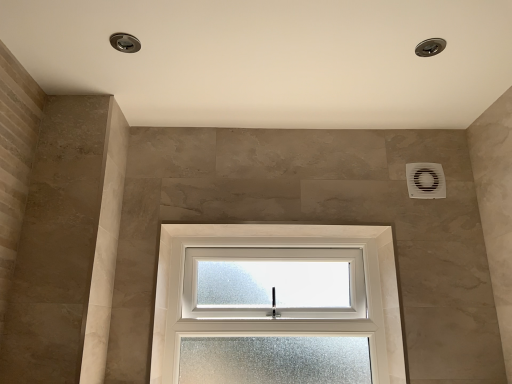
Describe the element at coordinates (282, 312) in the screenshot. The width and height of the screenshot is (512, 384). I see `white frosted glass window at center` at that location.

Where is `white frosted glass window at center`? This screenshot has height=384, width=512. white frosted glass window at center is located at coordinates (282, 312).

The width and height of the screenshot is (512, 384). Describe the element at coordinates (425, 180) in the screenshot. I see `white plastic air conditioning unit at upper right` at that location.

Identify the location of white plastic air conditioning unit at upper right. (425, 180).

Where is `white frosted glass window at center`? Image resolution: width=512 pixels, height=384 pixels. white frosted glass window at center is located at coordinates (282, 312).

Considering the positions of objects white frosted glass window at center and white plastic air conditioning unit at upper right in the image provided, who is more to the left, white frosted glass window at center or white plastic air conditioning unit at upper right?

white frosted glass window at center is more to the left.

Is the position of white frosted glass window at center less distant than that of white plastic air conditioning unit at upper right?

Yes, white frosted glass window at center is closer to the viewer.

Considering the positions of point (156, 370) and point (433, 165), is point (156, 370) closer or farther from the camera than point (433, 165)?

Point (156, 370) appears to be closer to the viewer than point (433, 165).

From the image's perspective, between white frosted glass window at center and white plastic air conditioning unit at upper right, who is located below?

white frosted glass window at center.

From a real-world perspective, who is located lower, white frosted glass window at center or white plastic air conditioning unit at upper right?

From a 3D spatial view, white frosted glass window at center is below.

Can you confirm if white frosted glass window at center is thinner than white plastic air conditioning unit at upper right?

Incorrect, the width of white frosted glass window at center is not less than that of white plastic air conditioning unit at upper right.

Considering the sizes of objects white frosted glass window at center and white plastic air conditioning unit at upper right in the image provided, who is shorter, white frosted glass window at center or white plastic air conditioning unit at upper right?

Standing shorter between the two is white plastic air conditioning unit at upper right.

Considering the relative sizes of white frosted glass window at center and white plastic air conditioning unit at upper right in the image provided, is white frosted glass window at center smaller than white plastic air conditioning unit at upper right?

Actually, white frosted glass window at center might be larger than white plastic air conditioning unit at upper right.

Is white frosted glass window at center positioned beyond the bounds of white plastic air conditioning unit at upper right?

Yes, white frosted glass window at center is outside of white plastic air conditioning unit at upper right.

Is white frosted glass window at center with white plastic air conditioning unit at upper right?

No, white frosted glass window at center is not making contact with white plastic air conditioning unit at upper right.

Does white frosted glass window at center turn towards white plastic air conditioning unit at upper right?

No, white frosted glass window at center is not oriented towards white plastic air conditioning unit at upper right.

Find the location of a particular element. The image size is (512, 384). window below the white plastic air conditioning unit at upper right (from the image's perspective) is located at coordinates (282, 312).

Which is more to the left, white plastic air conditioning unit at upper right or white frosted glass window at center?

From the viewer's perspective, white frosted glass window at center appears more on the left side.

Considering their positions, is white plastic air conditioning unit at upper right located in front of or behind white frosted glass window at center?

white plastic air conditioning unit at upper right is behind white frosted glass window at center.

Which is closer to the camera, (407,182) or (165,306)?

Clearly, point (407,182) is closer to the camera than point (165,306).

From the image's perspective, is white plastic air conditioning unit at upper right above or below white frosted glass window at center?

From the image's perspective, white plastic air conditioning unit at upper right appears above white frosted glass window at center.

From a real-world perspective, which object rests below the other?

From a 3D spatial view, white frosted glass window at center is below.

In terms of width, does white plastic air conditioning unit at upper right look wider or thinner when compared to white frosted glass window at center?

Considering their sizes, white plastic air conditioning unit at upper right looks slimmer than white frosted glass window at center.

Is white plastic air conditioning unit at upper right shorter than white frosted glass window at center?

Correct, white plastic air conditioning unit at upper right is not as tall as white frosted glass window at center.

Considering the sizes of objects white plastic air conditioning unit at upper right and white frosted glass window at center in the image provided, who is smaller, white plastic air conditioning unit at upper right or white frosted glass window at center?

white plastic air conditioning unit at upper right is smaller.

Based on the photo, is white plastic air conditioning unit at upper right surrounding white frosted glass window at center?

No, white frosted glass window at center is not surrounded by white plastic air conditioning unit at upper right.

Is white plastic air conditioning unit at upper right not close to white frosted glass window at center?

They are positioned close to each other.

Does white plastic air conditioning unit at upper right turn towards white frosted glass window at center?

No, white plastic air conditioning unit at upper right does not turn towards white frosted glass window at center.

You are a GUI agent. You are given a task and a screenshot of the screen. Output one action in this format:
    pyautogui.click(x=<x>, y=<y>)
    Task: Click on the window in front of the white plastic air conditioning unit at upper right
    This screenshot has width=512, height=384.
    Given the screenshot: What is the action you would take?
    click(282, 312)

At what (x,y) coordinates should I click in order to perform the action: click on air conditioning above the white frosted glass window at center (from a real-world perspective). Please return your answer as a coordinate pair (x, y). This screenshot has width=512, height=384. Looking at the image, I should click on (425, 180).

This screenshot has width=512, height=384. I want to click on air conditioning on the right of white frosted glass window at center, so click(425, 180).